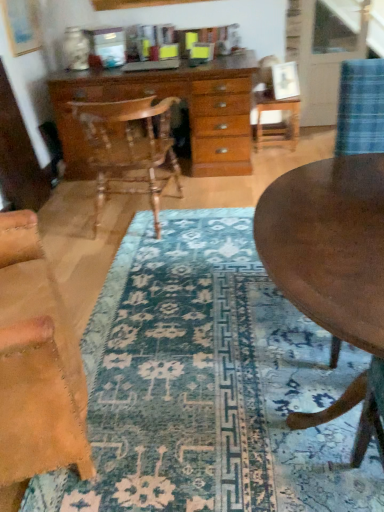
Find the location of a particular element. The width and height of the screenshot is (384, 512). empty space that is to the right of wooden side table at center is located at coordinates (306, 143).